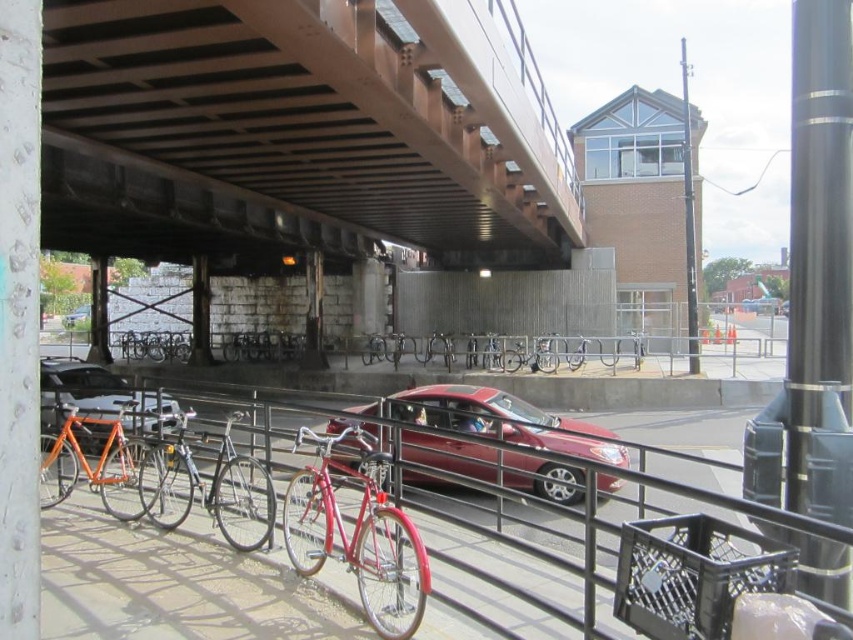
Question: Which of the following is the closest to the observer?

Choices:
 (A) (109, 410)
 (B) (442, 333)

Answer: (A)

Question: Is shiny metallic car at center further to the viewer compared to metallic silver sedan at center?

Choices:
 (A) no
 (B) yes

Answer: (A)

Question: Among these objects, which one is nearest to the camera?

Choices:
 (A) shiny silver bicycle at lower left
 (B) orange matte bicycle at lower left

Answer: (A)

Question: Which point is farther to the camera?

Choices:
 (A) (178, 195)
 (B) (48, 365)

Answer: (A)

Question: Does orange matte bicycle at lower left appear over shiny silver bicycle at lower left?

Choices:
 (A) yes
 (B) no

Answer: (A)

Question: Considering the relative positions of metallic gray bridge at upper center and shiny silver bicycle at center in the image provided, where is metallic gray bridge at upper center located with respect to shiny silver bicycle at center?

Choices:
 (A) below
 (B) above

Answer: (B)